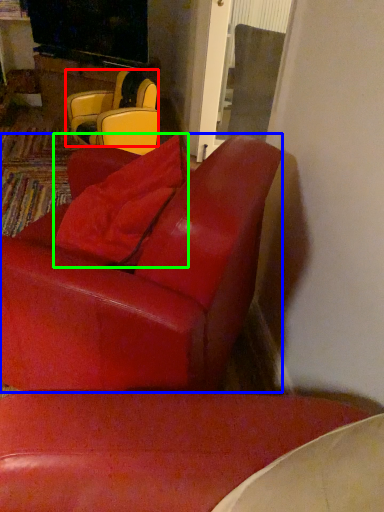
Question: Which object is positioned closest to chair (highlighted by a red box)? Select from chair (highlighted by a blue box) and pillow (highlighted by a green box).

Choices:
 (A) chair
 (B) pillow

Answer: (B)